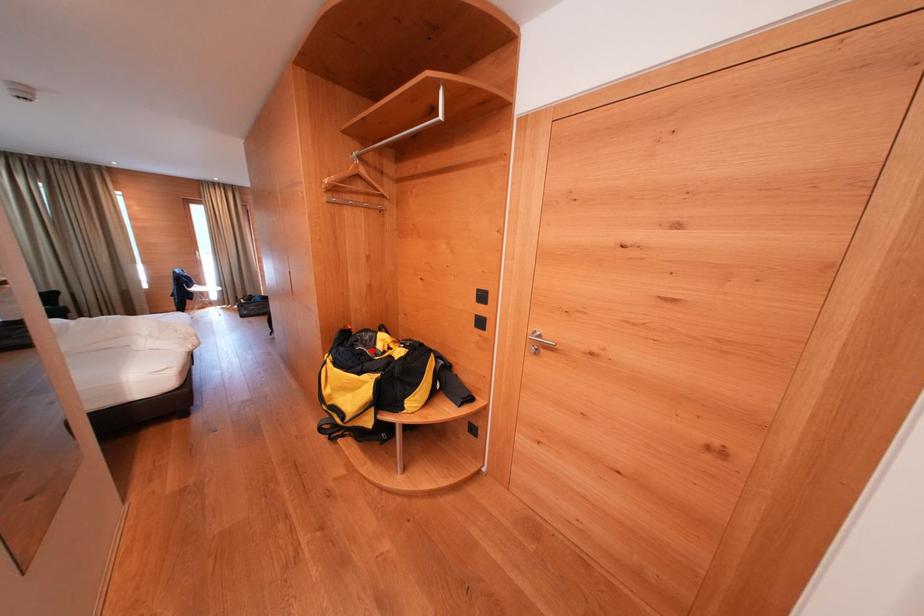
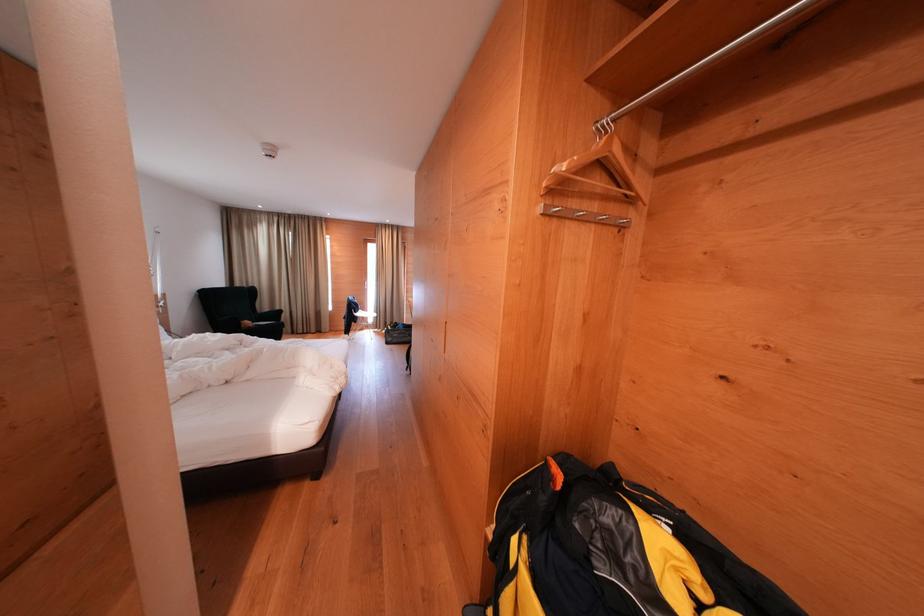
Where in the second image is the point corresponding to the highlighted location from the first image?

(635, 584)